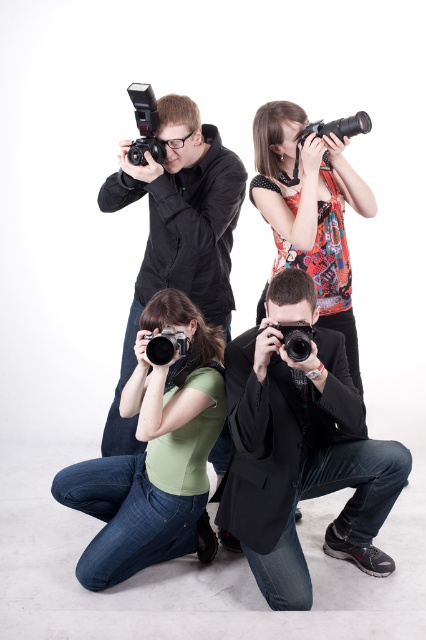
You are a photographer in the studio and want to ensure that all subjects are visible in your wide shot. Which subject should you focus on to include both the green matte shirt at lower left and the printed fabric top at upper right in the frame?

The green matte shirt at lower left has a larger size compared to the printed fabric top at upper right, so focusing on the larger green matte shirt at lower left would help ensure both subjects are included in the frame.